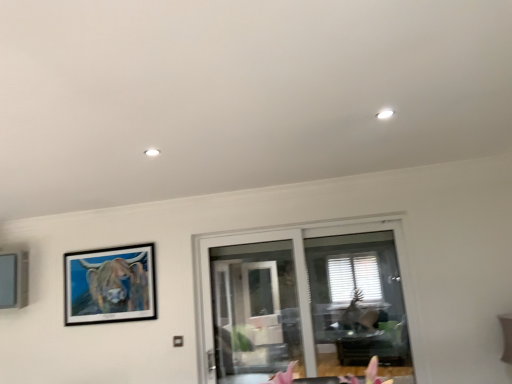
Question: Does transparent glass door at center have a greater width compared to wooden-framed painting at upper left, which ranks as the 2th picture frame in left-to-right order?

Choices:
 (A) no
 (B) yes

Answer: (B)

Question: Is the depth of transparent glass door at center less than that of wooden-framed painting at upper left, which ranks as the 2th picture frame in left-to-right order?

Choices:
 (A) yes
 (B) no

Answer: (A)

Question: From the image's perspective, is transparent glass door at center located beneath wooden-framed painting at upper left, marked as the 1th picture frame in a right-to-left arrangement?

Choices:
 (A) no
 (B) yes

Answer: (B)

Question: Is transparent glass door at center positioned with its back to wooden-framed painting at upper left, which ranks as the 2th picture frame in left-to-right order?

Choices:
 (A) yes
 (B) no

Answer: (B)

Question: Would you say transparent glass door at center is outside wooden-framed painting at upper left, marked as the 1th picture frame in a right-to-left arrangement?

Choices:
 (A) no
 (B) yes

Answer: (B)

Question: From the image's perspective, is transparent glass door at center positioned above or below wooden-framed painting at upper left, which ranks as the 2th picture frame in left-to-right order?

Choices:
 (A) below
 (B) above

Answer: (A)

Question: Is point (256, 344) closer or farther from the camera than point (118, 281)?

Choices:
 (A) farther
 (B) closer

Answer: (A)

Question: Considering the positions of transparent glass door at center and wooden-framed painting at upper left, which ranks as the 2th picture frame in left-to-right order, in the image, is transparent glass door at center taller or shorter than wooden-framed painting at upper left, which ranks as the 2th picture frame in left-to-right order,?

Choices:
 (A) short
 (B) tall

Answer: (B)

Question: Is transparent glass door at center in front of or behind wooden-framed painting at upper left, which ranks as the 2th picture frame in left-to-right order, in the image?

Choices:
 (A) front
 (B) behind

Answer: (A)

Question: From the image's perspective, relative to wooden-framed painting at upper left, marked as the 1th picture frame in a right-to-left arrangement, is matte gray picture frame at left, which is the first picture frame in left-to-right order, above or below?

Choices:
 (A) above
 (B) below

Answer: (A)

Question: In the image, is matte gray picture frame at left, which is the first picture frame in left-to-right order, on the left side or the right side of wooden-framed painting at upper left, marked as the 1th picture frame in a right-to-left arrangement?

Choices:
 (A) left
 (B) right

Answer: (A)

Question: In the image, is matte gray picture frame at left, which is the first picture frame in left-to-right order, positioned in front of or behind wooden-framed painting at upper left, marked as the 1th picture frame in a right-to-left arrangement?

Choices:
 (A) behind
 (B) front

Answer: (A)

Question: Does point (12, 306) appear closer or farther from the camera than point (145, 292)?

Choices:
 (A) farther
 (B) closer

Answer: (A)

Question: In terms of width, does wooden-framed painting at upper left, marked as the 1th picture frame in a right-to-left arrangement, look wider or thinner when compared to transparent glass door at center?

Choices:
 (A) thin
 (B) wide

Answer: (A)

Question: Is wooden-framed painting at upper left, marked as the 1th picture frame in a right-to-left arrangement, inside or outside of transparent glass door at center?

Choices:
 (A) outside
 (B) inside

Answer: (A)